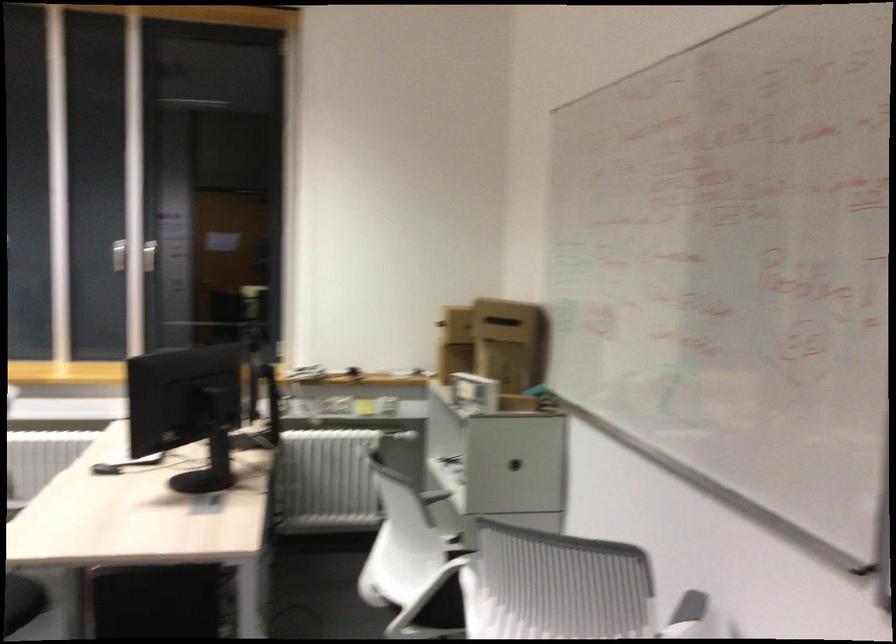
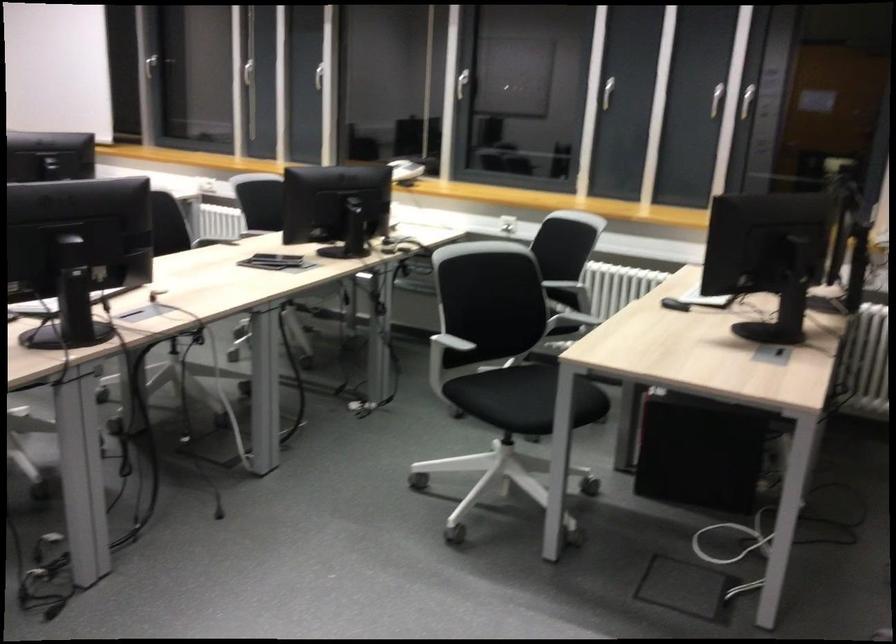
In the second image, find the point that corresponds to point 147,263 in the first image.

(746, 100)